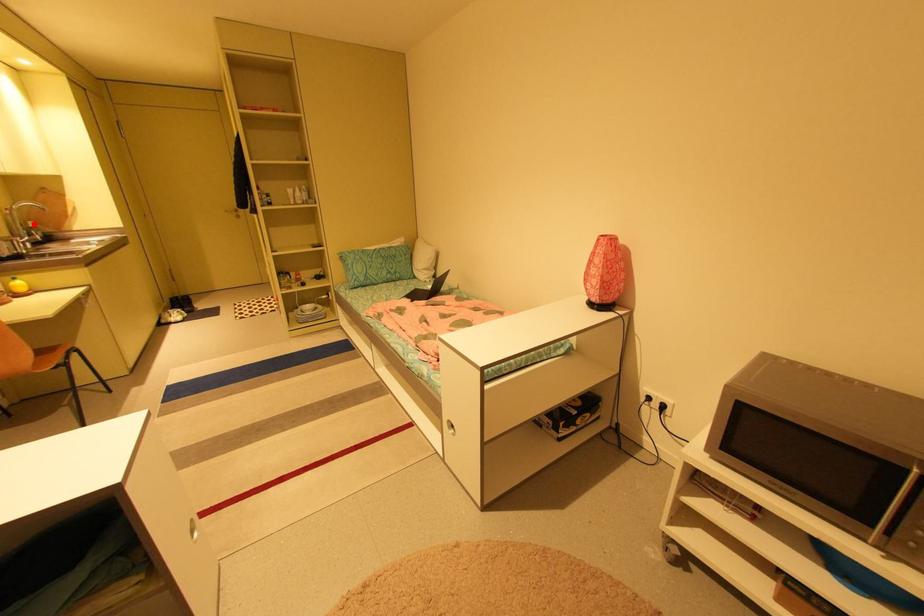
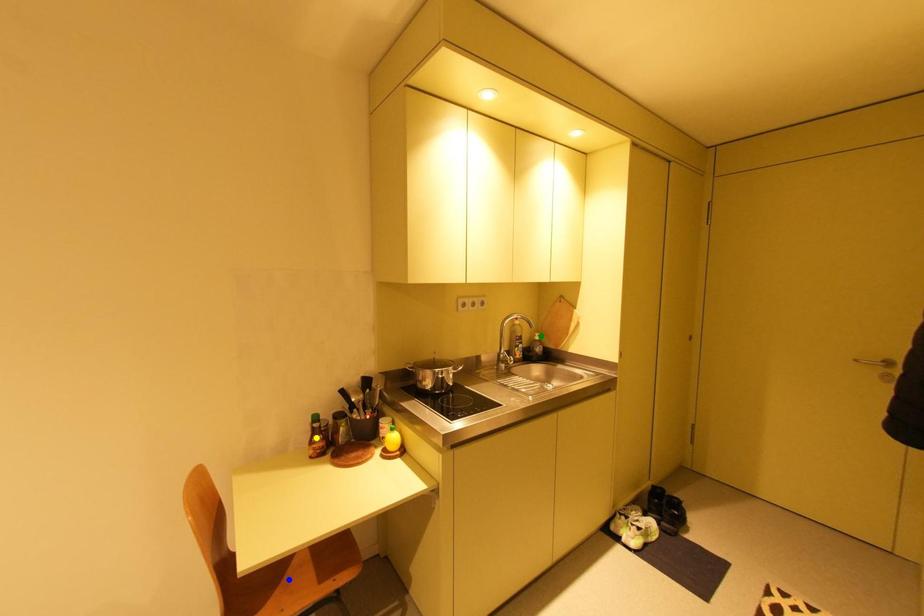
Question: I am providing you with two images of the same scene from different viewpoints. A red point is marked on the first image. You are given multiple points on the second image. Which spot in image 2 lines up with the point in image 1?

Choices:
 (A) green point
 (B) yellow point
 (C) blue point

Answer: (A)